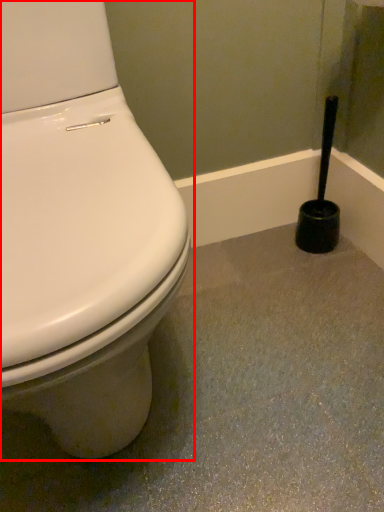
Question: Where is toilet (annotated by the red box) located in relation to brush in the image?

Choices:
 (A) right
 (B) left

Answer: (B)